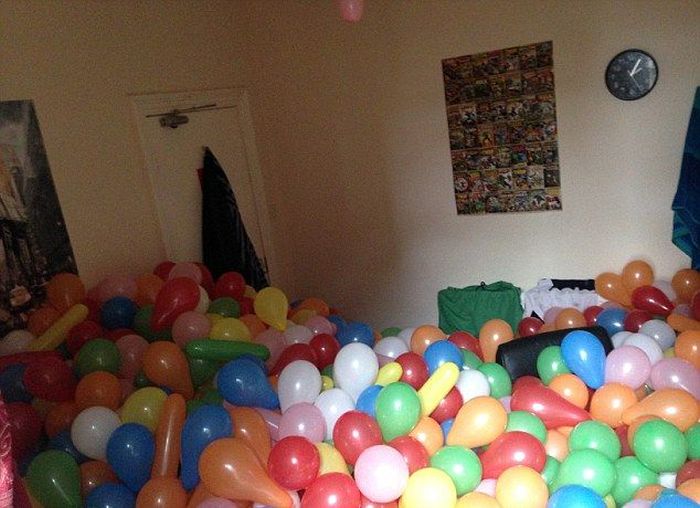
I want to click on poster, so click(495, 125).